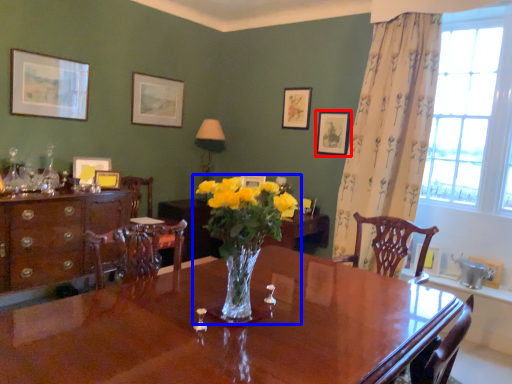
Question: Among these objects, which one is farthest to the camera, picture frame (highlighted by a red box) or houseplant (highlighted by a blue box)?

Choices:
 (A) picture frame
 (B) houseplant

Answer: (A)